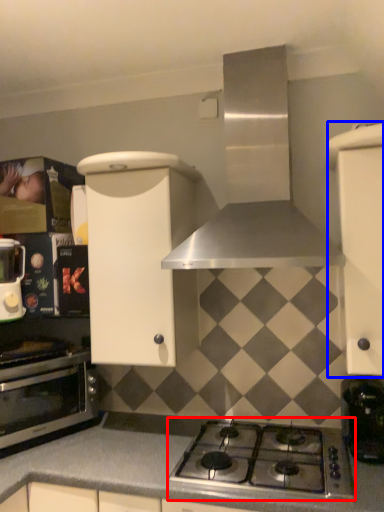
Question: Which object appears closest to the camera in this image, gas stove (highlighted by a red box) or cabinetry (highlighted by a blue box)?

Choices:
 (A) gas stove
 (B) cabinetry

Answer: (A)